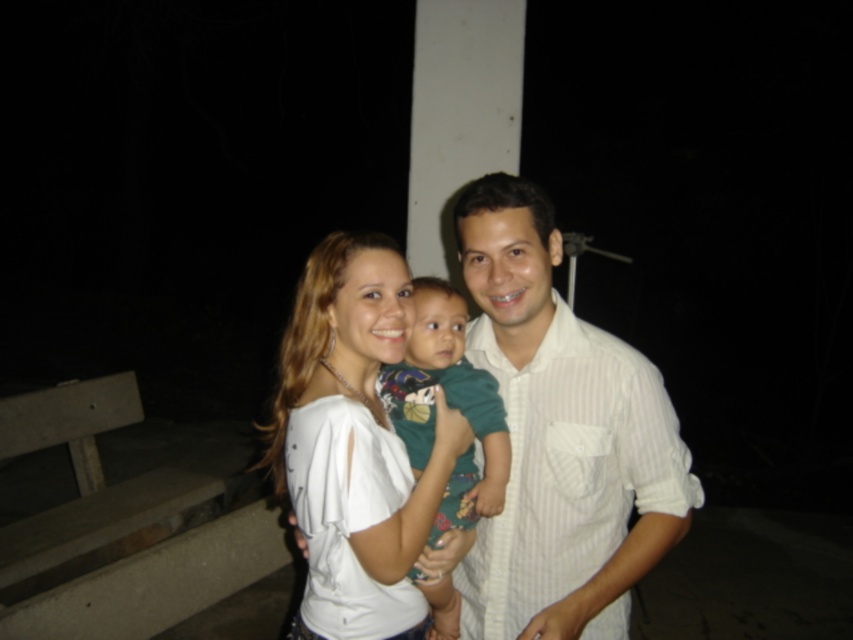
Is point (310, 308) behind point (386, 388)?

No.

Describe the element at coordinates (354, 442) in the screenshot. I see `white cotton shirt at center` at that location.

Find the location of a particular element. This screenshot has width=853, height=640. white cotton shirt at center is located at coordinates (354, 442).

Between white striped shirt at center and white cotton shirt at center, which one has more height?

Standing taller between the two is white striped shirt at center.

Is white striped shirt at center bigger than white cotton shirt at center?

Incorrect, white striped shirt at center is not larger than white cotton shirt at center.

Who is more distant from viewer, (x=607, y=493) or (x=376, y=372)?

Positioned behind is point (x=376, y=372).

What are the coordinates of `white striped shirt at center` in the screenshot? It's located at (560, 438).

Is white striped shirt at center above green fabric shirt at center?

Yes.

Where is `white striped shirt at center`? This screenshot has height=640, width=853. white striped shirt at center is located at coordinates (560, 438).